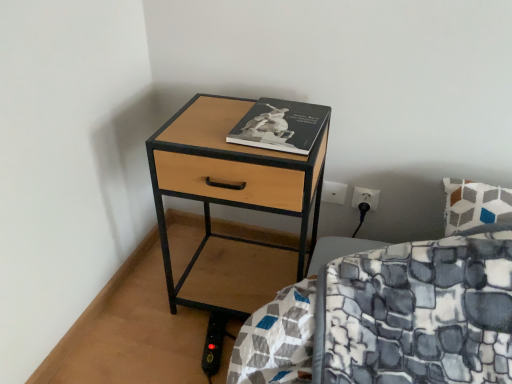
Question: Is black matte book at center wider or thinner than woodenmaterial/texturenightstand at lower left?

Choices:
 (A) thin
 (B) wide

Answer: (A)

Question: Is black matte book at center spatially inside woodenmaterial/texturenightstand at lower left, or outside of it?

Choices:
 (A) outside
 (B) inside

Answer: (A)

Question: Relative to woodenmaterial/texturenightstand at lower left, is black matte book at center in front or behind?

Choices:
 (A) front
 (B) behind

Answer: (B)

Question: Considering the positions of woodenmaterial/texturenightstand at lower left and black matte book at center in the image, is woodenmaterial/texturenightstand at lower left bigger or smaller than black matte book at center?

Choices:
 (A) big
 (B) small

Answer: (A)

Question: From the image's perspective, is woodenmaterial/texturenightstand at lower left above or below black matte book at center?

Choices:
 (A) above
 (B) below

Answer: (B)

Question: From a real-world perspective, is woodenmaterial/texturenightstand at lower left positioned above or below black matte book at center?

Choices:
 (A) above
 (B) below

Answer: (B)

Question: In the image, is woodenmaterial/texturenightstand at lower left positioned in front of or behind black matte book at center?

Choices:
 (A) behind
 (B) front

Answer: (B)